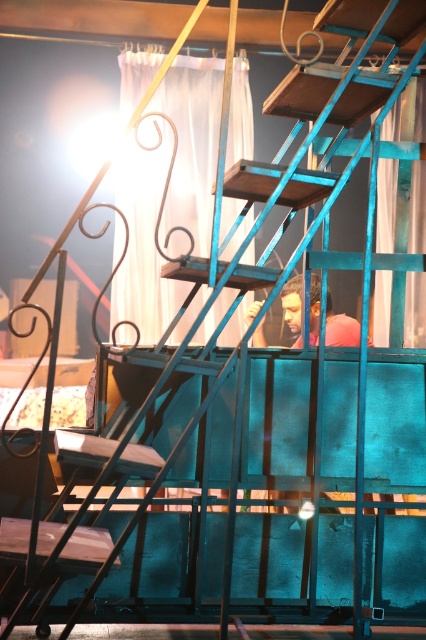
Question: Which point is closer to the camera taking this photo?

Choices:
 (A) (325, 330)
 (B) (250, 148)
 (C) (399, 131)

Answer: (A)

Question: Is translucent fabric curtain at upper center closer to camera compared to white sheer curtain at upper center?

Choices:
 (A) yes
 (B) no

Answer: (B)

Question: Which point is closer to the camera?

Choices:
 (A) white sheer curtain at upper center
 (B) matte black head at center

Answer: (B)

Question: Considering the relative positions of translucent fabric curtain at upper center and matte black head at center in the image provided, where is translucent fabric curtain at upper center located with respect to matte black head at center?

Choices:
 (A) above
 (B) below

Answer: (A)

Question: Is translucent fabric curtain at upper center behind matte black head at center?

Choices:
 (A) yes
 (B) no

Answer: (A)

Question: Among these objects, which one is farthest from the camera?

Choices:
 (A) white sheer curtain at upper center
 (B) matte black head at center

Answer: (A)